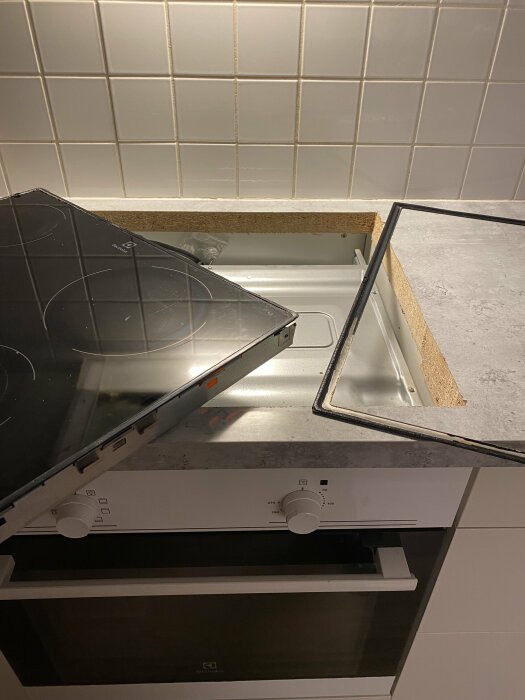
Locate an element on the screen. oven door is located at coordinates (325, 631), (319, 678).